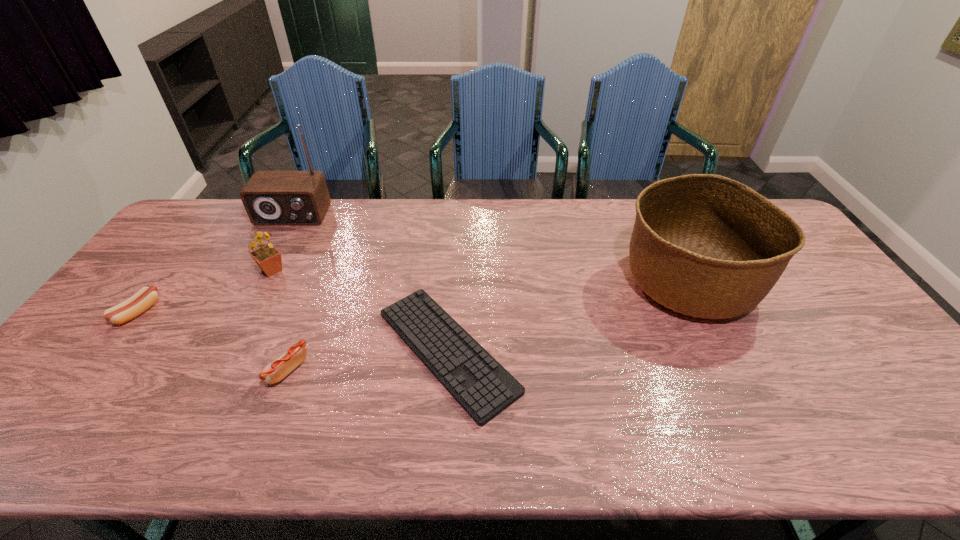
I want to click on radio receiver, so click(x=270, y=197).

Locate an element on the screen. This screenshot has width=960, height=540. the tallest object is located at coordinates (270, 197).

The height and width of the screenshot is (540, 960). Find the location of `the fifth shortest object`. the fifth shortest object is located at coordinates pos(704,245).

This screenshot has width=960, height=540. I want to click on basket, so click(704, 245).

Where is `sunflower`? The height and width of the screenshot is (540, 960). sunflower is located at coordinates (268, 258).

You are a GUI agent. You are given a task and a screenshot of the screen. Output one action in this format:
    pyautogui.click(x=<x>, y=<y>)
    Task: Click on the right sausage
    The width and height of the screenshot is (960, 540).
    Given the screenshot: What is the action you would take?
    pyautogui.click(x=291, y=358)

Where is `the nearer sausage`? the nearer sausage is located at coordinates point(291,358).

Locate an element on the screen. This screenshot has height=540, width=960. the left sausage is located at coordinates (141, 301).

Find the location of `the farther sausage`. the farther sausage is located at coordinates (141, 301).

What are the coordinates of `the second object from right to left` in the screenshot? It's located at (477, 381).